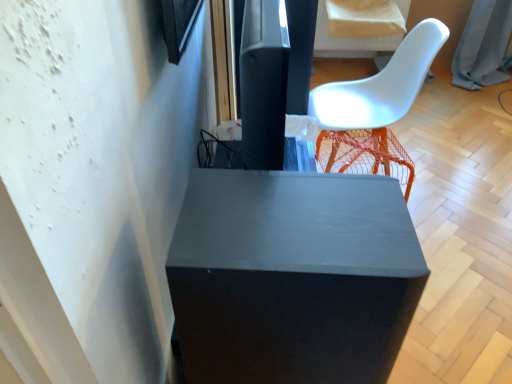
Question: Relative to orange mesh stool at right, is matte black cube at center in front or behind?

Choices:
 (A) front
 (B) behind

Answer: (A)

Question: Is point (182, 324) closer or farther from the camera than point (362, 147)?

Choices:
 (A) farther
 (B) closer

Answer: (B)

Question: Which is farther from the matte black cube at center?

Choices:
 (A) matte black speaker at upper center
 (B) white plastic chair at upper right
 (C) orange mesh stool at right

Answer: (B)

Question: Estimate the real-world distances between objects in this image. Which object is closer to the matte black speaker at upper center?

Choices:
 (A) matte black cube at center
 (B) white plastic chair at upper right
 (C) orange mesh stool at right

Answer: (A)